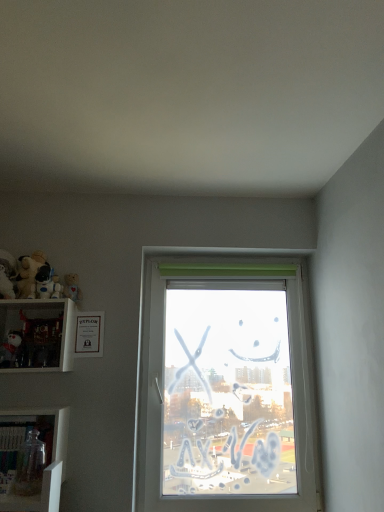
Question: Is soft plush bear at upper left, which is the 4th toy in bottom-to-top order, spatially inside white glossy shelf at left, the second shelf when ordered from bottom to top, or outside of it?

Choices:
 (A) inside
 (B) outside

Answer: (B)

Question: In the image, is soft plush bear at upper left, which is the 4th toy in bottom-to-top order, on the left side or the right side of white glossy shelf at left, the second shelf when ordered from bottom to top?

Choices:
 (A) left
 (B) right

Answer: (A)

Question: Which object is the farthest from the transparent glass jar at lower left, the 1th toy from the bottom?

Choices:
 (A) matte white plush at left, placed as the 4th toy when sorted from top to bottom
 (B) white glossy shelf at left, the first shelf in the top-to-bottom sequence
 (C) soft plush bear at upper left, which is the 4th toy in bottom-to-top order
 (D) transparent glass window at center
 (E) clear glass jar at lower left, the second shelf viewed from the top

Answer: (D)

Question: Which object is the farthest from the transparent glass jar at lower left, the 1th toy from the bottom?

Choices:
 (A) soft plush bear at upper left, the 2th toy in the top-to-bottom sequence
 (B) matte white plush at left, placed as the 4th toy when sorted from top to bottom
 (C) fluffy beige teddy bear at left, the 1th toy in the top-to-bottom sequence
 (D) clear glass jar at lower left, the second shelf viewed from the top
 (E) white plush toy at upper left, which appears as the third toy when viewed from the top

Answer: (C)